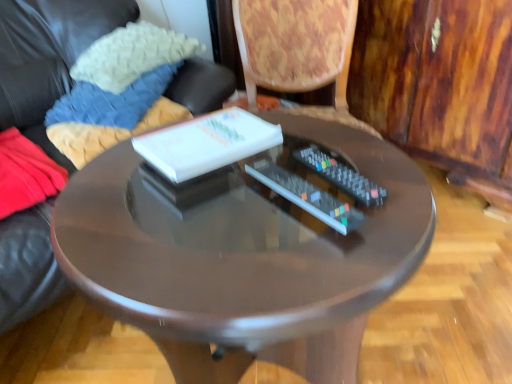
Question: Can white knitted pillow at upper left, the 2th pillow from the bottom, be found inside glossy wood table at center?

Choices:
 (A) no
 (B) yes

Answer: (A)

Question: Does glossy wood table at center have a smaller size compared to white knitted pillow at upper left, the 2th pillow from the bottom?

Choices:
 (A) yes
 (B) no

Answer: (B)

Question: Are glossy wood table at center and white knitted pillow at upper left, the 2th pillow from the bottom, beside each other?

Choices:
 (A) no
 (B) yes

Answer: (A)

Question: Considering the relative sizes of glossy wood table at center and white knitted pillow at upper left, the 2th pillow from the bottom, in the image provided, is glossy wood table at center shorter than white knitted pillow at upper left, the 2th pillow from the bottom,?

Choices:
 (A) yes
 (B) no

Answer: (B)

Question: From a real-world perspective, is glossy wood table at center physically above white knitted pillow at upper left, the 2th pillow from the bottom?

Choices:
 (A) no
 (B) yes

Answer: (A)

Question: Can you confirm if glossy wood table at center is taller than white knitted pillow at upper left, which is the 1th pillow in top-to-bottom order?

Choices:
 (A) no
 (B) yes

Answer: (B)

Question: Can you confirm if white knitted pillow at upper left, the 2th pillow from the bottom, is thinner than glossy wood table at center?

Choices:
 (A) yes
 (B) no

Answer: (A)

Question: Is white knitted pillow at upper left, the 2th pillow from the bottom, positioned with its back to glossy wood table at center?

Choices:
 (A) yes
 (B) no

Answer: (B)

Question: Considering the relative sizes of white knitted pillow at upper left, the 2th pillow from the bottom, and glossy wood table at center in the image provided, is white knitted pillow at upper left, the 2th pillow from the bottom, taller than glossy wood table at center?

Choices:
 (A) no
 (B) yes

Answer: (A)

Question: Would you say white knitted pillow at upper left, the 2th pillow from the bottom, contains glossy wood table at center?

Choices:
 (A) yes
 (B) no

Answer: (B)

Question: Does white knitted pillow at upper left, which is the 1th pillow in top-to-bottom order, come behind glossy wood table at center?

Choices:
 (A) no
 (B) yes

Answer: (B)

Question: Does white knitted pillow at upper left, which is the 1th pillow in top-to-bottom order, have a lesser height compared to glossy wood table at center?

Choices:
 (A) yes
 (B) no

Answer: (A)

Question: From the image's perspective, is black plastic remote at center, which is the second remote control from left to right, located above matte black remote control at center, the first remote control positioned from the left?

Choices:
 (A) no
 (B) yes

Answer: (B)